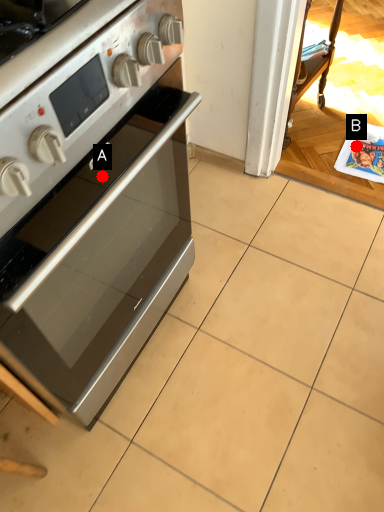
Question: Two points are circled on the image, labeled by A and B beside each circle. Which point appears farthest from the camera in this image?

Choices:
 (A) A is further
 (B) B is further

Answer: (B)